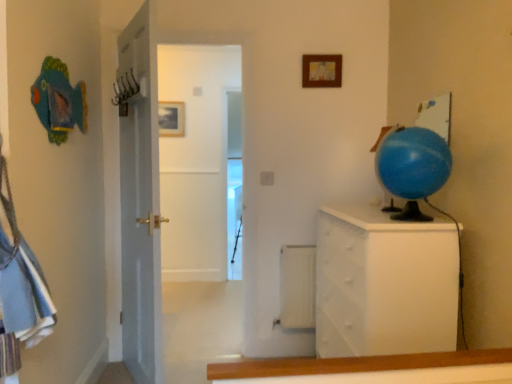
Question: Is white textured chest of drawers at right wider than blue rubber globe at right?

Choices:
 (A) no
 (B) yes

Answer: (B)

Question: Is white textured chest of drawers at right smaller than blue rubber globe at right?

Choices:
 (A) yes
 (B) no

Answer: (B)

Question: Is white textured chest of drawers at right to the right of blue rubber globe at right from the viewer's perspective?

Choices:
 (A) yes
 (B) no

Answer: (B)

Question: Can you confirm if white textured chest of drawers at right is shorter than blue rubber globe at right?

Choices:
 (A) yes
 (B) no

Answer: (B)

Question: Does white textured chest of drawers at right lie in front of blue rubber globe at right?

Choices:
 (A) no
 (B) yes

Answer: (A)

Question: Based on their sizes in the image, would you say wooden picture frame at upper center, placed as the second picture frame when sorted from left to right, is bigger or smaller than white textured chest of drawers at right?

Choices:
 (A) big
 (B) small

Answer: (B)

Question: From a real-world perspective, relative to white textured chest of drawers at right, is wooden picture frame at upper center, the second picture frame viewed from the back, vertically above or below?

Choices:
 (A) below
 (B) above

Answer: (B)

Question: Looking at their shapes, would you say wooden picture frame at upper center, placed as the second picture frame when sorted from left to right, is wider or thinner than white textured chest of drawers at right?

Choices:
 (A) thin
 (B) wide

Answer: (A)

Question: In the image, is wooden picture frame at upper center, placed as the 1th picture frame when sorted from front to back, positioned in front of or behind white textured chest of drawers at right?

Choices:
 (A) front
 (B) behind

Answer: (B)

Question: Is matte gold picture frame at upper center, marked as the 2th picture frame in a front-to-back arrangement, bigger or smaller than wooden picture frame at upper center, placed as the second picture frame when sorted from left to right?

Choices:
 (A) big
 (B) small

Answer: (A)

Question: Considering the positions of matte gold picture frame at upper center, which is the 2th picture frame in right-to-left order, and wooden picture frame at upper center, the 1th picture frame positioned from the right, in the image, is matte gold picture frame at upper center, which is the 2th picture frame in right-to-left order, wider or thinner than wooden picture frame at upper center, the 1th picture frame positioned from the right,?

Choices:
 (A) wide
 (B) thin

Answer: (B)

Question: From a real-world perspective, is matte gold picture frame at upper center, positioned as the first picture frame in back-to-front order, physically located above or below wooden picture frame at upper center, the 1th picture frame positioned from the right?

Choices:
 (A) above
 (B) below

Answer: (B)

Question: Is matte gold picture frame at upper center, acting as the first picture frame starting from the left, taller or shorter than wooden picture frame at upper center, placed as the 1th picture frame when sorted from front to back?

Choices:
 (A) tall
 (B) short

Answer: (A)

Question: Is matte gold picture frame at upper center, which is the 2th picture frame in right-to-left order, wider or thinner than white textured chest of drawers at right?

Choices:
 (A) thin
 (B) wide

Answer: (A)

Question: From the image's perspective, relative to white textured chest of drawers at right, is matte gold picture frame at upper center, marked as the 2th picture frame in a front-to-back arrangement, above or below?

Choices:
 (A) above
 (B) below

Answer: (A)